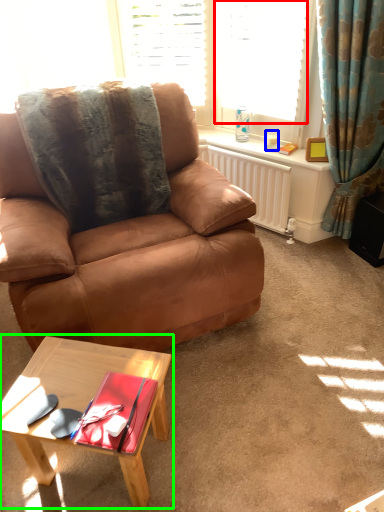
Question: Estimate the real-world distances between objects in this image. Which object is farther from window (highlighted by a red box), coffee cup (highlighted by a blue box) or coffee table (highlighted by a green box)?

Choices:
 (A) coffee cup
 (B) coffee table

Answer: (B)